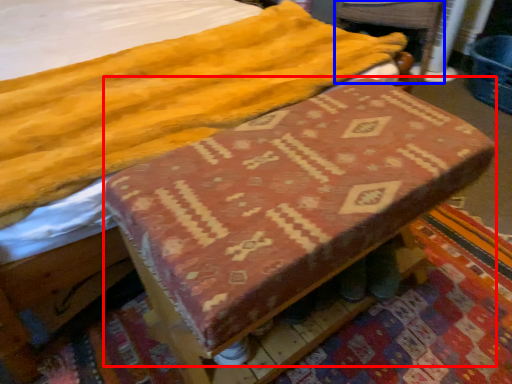
Question: Among these objects, which one is nearest to the camera, changing table (highlighted by a red box) or swivel chair (highlighted by a blue box)?

Choices:
 (A) changing table
 (B) swivel chair

Answer: (A)